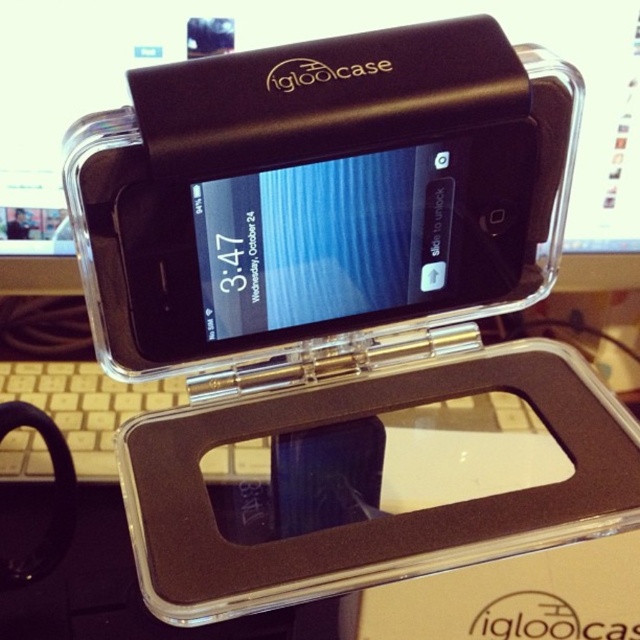
Question: From the image, what is the correct spatial relationship of transparent plastic computer monitor at center in relation to beige plastic keyboard at lower left?

Choices:
 (A) below
 (B) above

Answer: (B)

Question: Which of the following is the farthest from the observer?

Choices:
 (A) (84, 72)
 (B) (0, 456)

Answer: (A)

Question: Does transparent plastic computer monitor at center appear under beige plastic keyboard at lower left?

Choices:
 (A) yes
 (B) no

Answer: (B)

Question: Which object appears closest to the camera in this image?

Choices:
 (A) transparent plastic computer monitor at center
 (B) beige plastic keyboard at lower left

Answer: (A)

Question: Is transparent plastic computer monitor at center closer to the viewer compared to beige plastic keyboard at lower left?

Choices:
 (A) yes
 (B) no

Answer: (A)